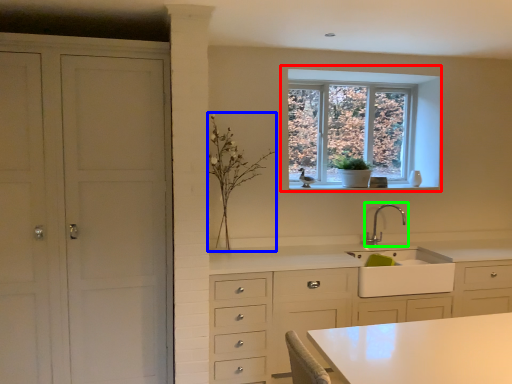
Question: Which object is positioned closest to window (highlighted by a red box)? Select from plant (highlighted by a blue box) and tap (highlighted by a green box).

Choices:
 (A) plant
 (B) tap

Answer: (B)